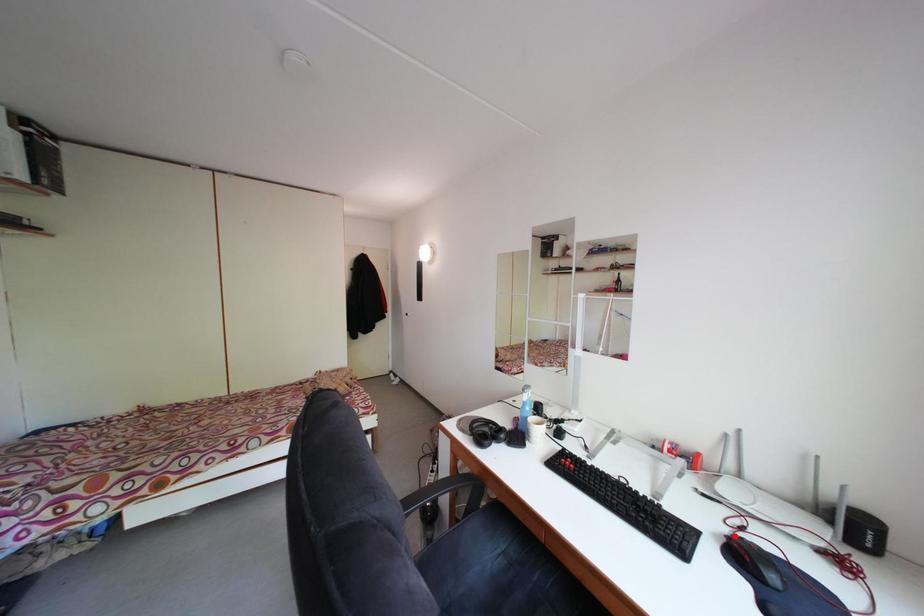
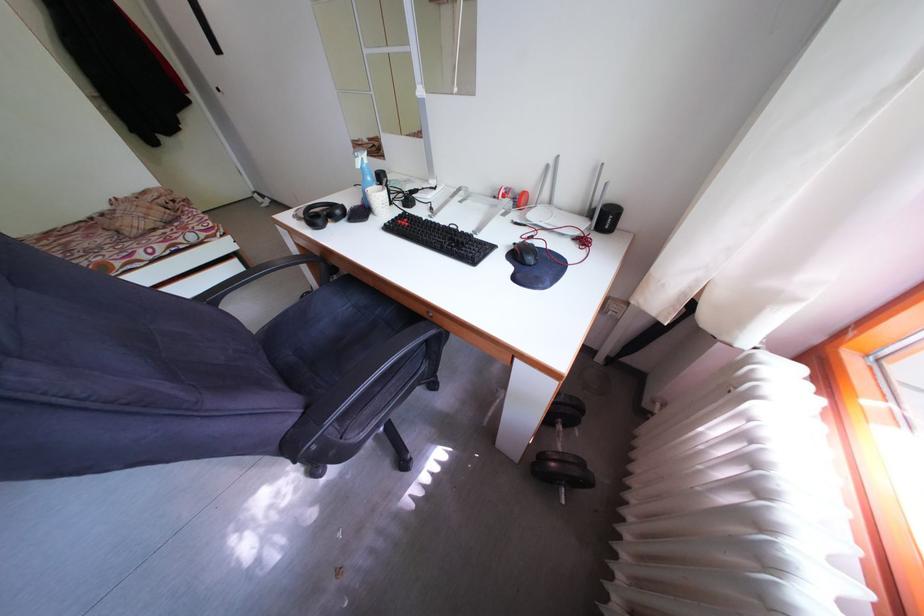
Locate, in the second image, the point that corresponds to the highlighted location in the first image.

(527, 246)